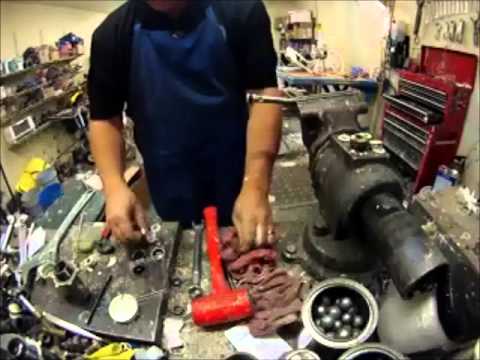
Locate an element on the screen. The image size is (480, 360). floor is located at coordinates (296, 197).